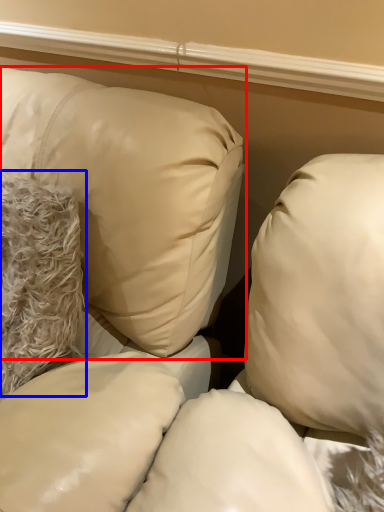
Question: Among these objects, which one is nearest to the camera, pillow (highlighted by a red box) or pillow (highlighted by a blue box)?

Choices:
 (A) pillow
 (B) pillow

Answer: (A)